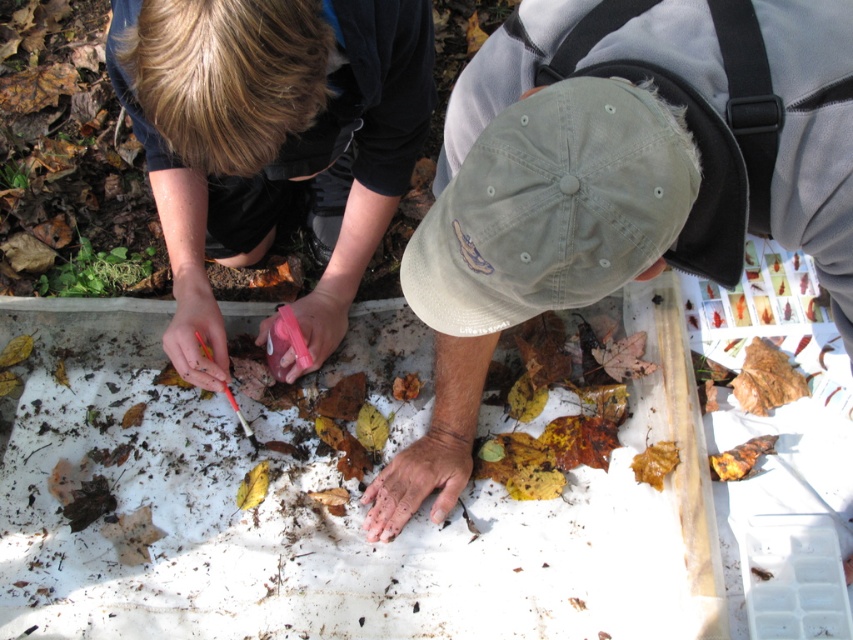
Can you confirm if smooth black shirt at upper left is taller than khaki fabric baseball cap at center?

Indeed, smooth black shirt at upper left has a greater height compared to khaki fabric baseball cap at center.

The width and height of the screenshot is (853, 640). What are the coordinates of `smooth black shirt at upper left` in the screenshot? It's located at (271, 140).

Does khaki cotton cap at center lie behind khaki fabric baseball cap at center?

Yes, it is.

Consider the image. Does khaki cotton cap at center appear on the left side of khaki fabric baseball cap at center?

In fact, khaki cotton cap at center is to the right of khaki fabric baseball cap at center.

Who is more forward, (585, 172) or (560, 140)?

Point (585, 172)

Where is `khaki cotton cap at center`? khaki cotton cap at center is located at coordinates (633, 160).

Which is in front, point (369, 540) or point (337, 314)?

Point (369, 540) is in front.

Is dry dirt at center below rubberized plastic spoon at center?

Yes.

The width and height of the screenshot is (853, 640). What do you see at coordinates (422, 472) in the screenshot?
I see `dry dirt at center` at bounding box center [422, 472].

You are a GUI agent. You are given a task and a screenshot of the screen. Output one action in this format:
    pyautogui.click(x=<x>, y=<y>)
    Task: Click on the dry dirt at center
    This screenshot has width=853, height=640.
    Given the screenshot: What is the action you would take?
    pyautogui.click(x=422, y=472)